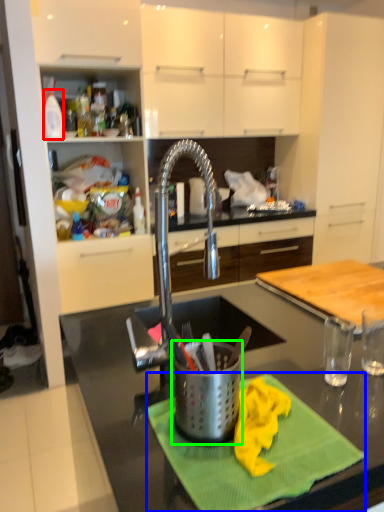
Question: Considering the real-world distances, which object is closest to kitchen appliance (highlighted by a red box)? place mat (highlighted by a blue box) or appliance (highlighted by a green box).

Choices:
 (A) place mat
 (B) appliance

Answer: (B)